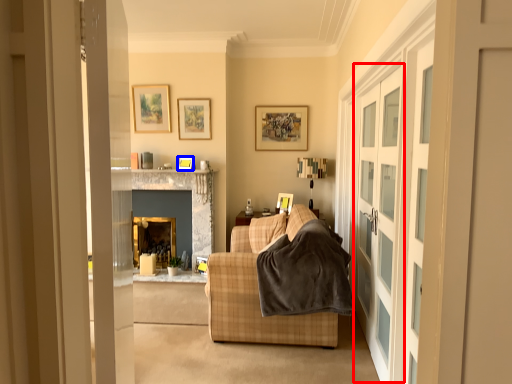
Question: Which object is closer to the camera taking this photo, screen door (highlighted by a red box) or picture frame (highlighted by a blue box)?

Choices:
 (A) screen door
 (B) picture frame

Answer: (A)